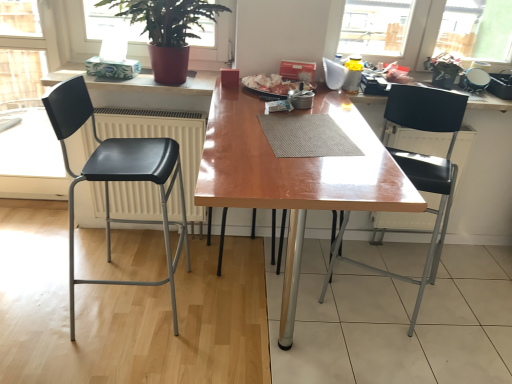
Identify the location of free location in front of black plastic chair at right, which is the 2th chair in left-to-right order. This screenshot has width=512, height=384. (434, 357).